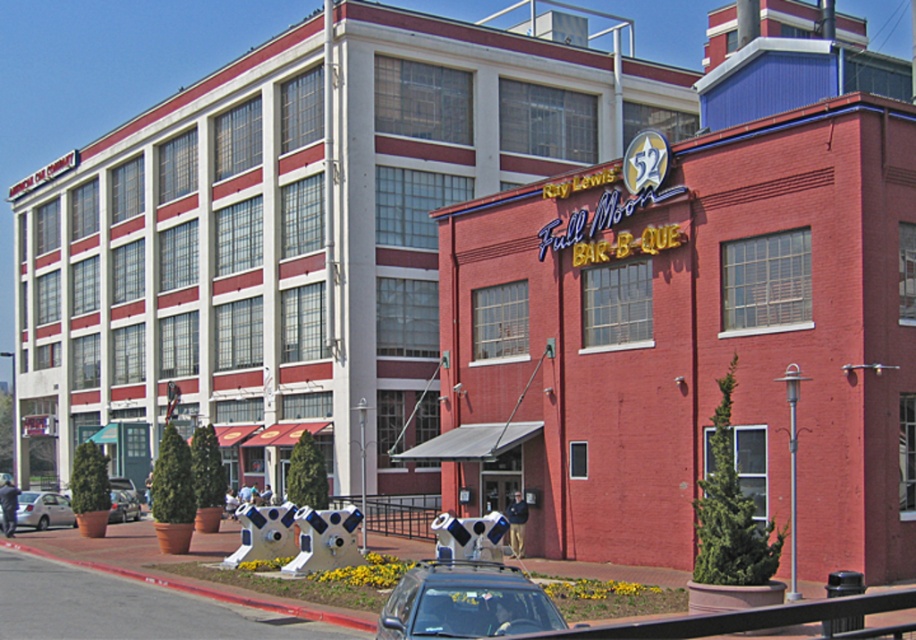
Looking at this image, does matte black car at center come in front of metallic silver car at lower left?

Yes.

Can you confirm if matte black car at center is positioned to the right of metallic silver car at lower left?

Yes, matte black car at center is to the right of metallic silver car at lower left.

Which is behind, point (508, 586) or point (129, 509)?

Point (129, 509)

The image size is (916, 640). In order to click on matte black car at center in this screenshot , I will do `click(465, 602)`.

Does matte black car at center have a larger size compared to silver metallic sedan at lower left?

Incorrect, matte black car at center is not larger than silver metallic sedan at lower left.

The width and height of the screenshot is (916, 640). What do you see at coordinates (465, 602) in the screenshot?
I see `matte black car at center` at bounding box center [465, 602].

Where is `matte black car at center`? This screenshot has height=640, width=916. matte black car at center is located at coordinates (465, 602).

At what (x,y) coordinates should I click in order to perform the action: click on matte black car at center. Please return your answer as a coordinate pair (x, y). The width and height of the screenshot is (916, 640). Looking at the image, I should click on (465, 602).

Is silver metallic sedan at lower left positioned in front of metallic silver car at lower left?

Yes, silver metallic sedan at lower left is in front of metallic silver car at lower left.

Can you confirm if silver metallic sedan at lower left is positioned above metallic silver car at lower left?

Yes.

What do you see at coordinates (42, 509) in the screenshot? The image size is (916, 640). I see `silver metallic sedan at lower left` at bounding box center [42, 509].

Image resolution: width=916 pixels, height=640 pixels. In order to click on silver metallic sedan at lower left in this screenshot , I will do `click(42, 509)`.